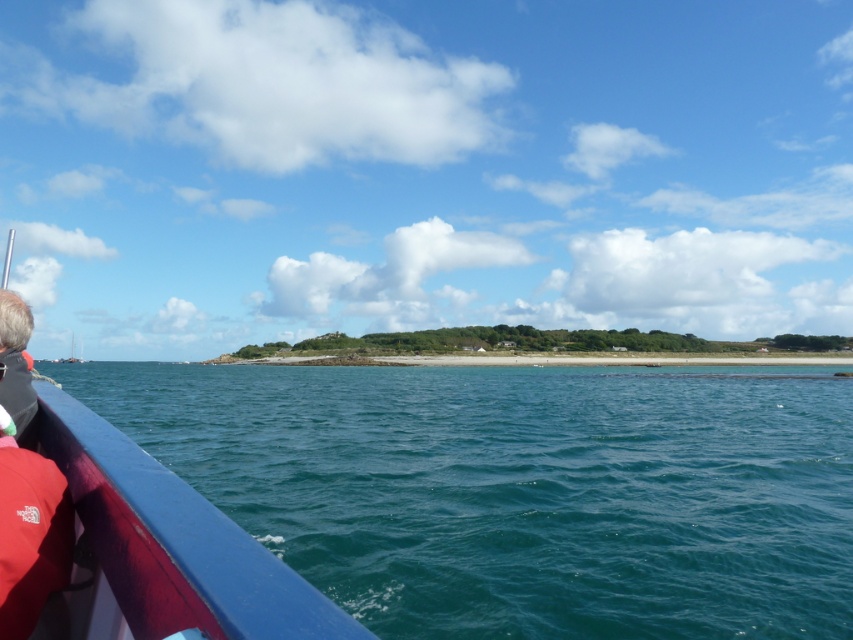
You are standing on the deck of a boat and want to estimate how far the deep blue water at lower left is from you. Based on the scene, can you determine the distance?

The deep blue water at lower left is 20.96 feet away from the camera, so the distance is approximately 21 feet.

You are standing on the boat deck and see the deep blue water at lower left and the red fabric life jacket at lower left. Which object takes up more space in the image?

The deep blue water at lower left takes up more space in the image because it is bigger than the red fabric life jacket at lower left.

You are standing on the boat deck and see the deep blue water at lower left and the gray fabric at left. Which object appears higher in the image?

The deep blue water at lower left appears higher because it is taller than the gray fabric at left.